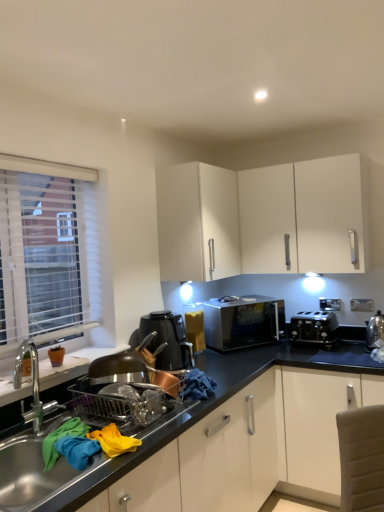
Question: From the image's perspective, is satin silver microwave at center on black plastic toaster at lower right, which is the second appliance in front-to-back order?

Choices:
 (A) yes
 (B) no

Answer: (A)

Question: Is satin silver microwave at center smaller than black plastic toaster at lower right, the first appliance when ordered from back to front?

Choices:
 (A) yes
 (B) no

Answer: (B)

Question: Is the position of satin silver microwave at center more distant than that of black plastic toaster at lower right, which is the second appliance in front-to-back order?

Choices:
 (A) no
 (B) yes

Answer: (B)

Question: Is satin silver microwave at center at the left side of black plastic toaster at lower right, the first appliance when ordered from back to front?

Choices:
 (A) no
 (B) yes

Answer: (B)

Question: Is satin silver microwave at center bigger than black plastic toaster at lower right, the first appliance when ordered from back to front?

Choices:
 (A) yes
 (B) no

Answer: (A)

Question: Choose the correct answer: Is metallic stainless steel sink at lower left inside satin silver microwave at center or outside it?

Choices:
 (A) inside
 (B) outside

Answer: (B)

Question: Is metallic stainless steel sink at lower left in front of or behind satin silver microwave at center in the image?

Choices:
 (A) behind
 (B) front

Answer: (B)

Question: Is point (79, 481) positioned closer to the camera than point (258, 295)?

Choices:
 (A) farther
 (B) closer

Answer: (B)

Question: Is metallic stainless steel sink at lower left bigger or smaller than satin silver microwave at center?

Choices:
 (A) big
 (B) small

Answer: (A)

Question: Considering the positions of black plastic kettle at center and satin silver kettle at right, which is the 2th appliance in left-to-right order, in the image, is black plastic kettle at center wider or thinner than satin silver kettle at right, which is the 2th appliance in left-to-right order,?

Choices:
 (A) wide
 (B) thin

Answer: (A)

Question: Considering the positions of black plastic kettle at center and satin silver kettle at right, which ranks as the second appliance in back-to-front order, in the image, is black plastic kettle at center bigger or smaller than satin silver kettle at right, which ranks as the second appliance in back-to-front order,?

Choices:
 (A) small
 (B) big

Answer: (B)

Question: From a real-world perspective, relative to satin silver kettle at right, the first appliance when ordered from front to back, is black plastic kettle at center vertically above or below?

Choices:
 (A) below
 (B) above

Answer: (B)

Question: Considering the relative positions of black plastic kettle at center and satin silver kettle at right, the first appliance when ordered from front to back, in the image provided, is black plastic kettle at center to the left or to the right of satin silver kettle at right, the first appliance when ordered from front to back,?

Choices:
 (A) left
 (B) right

Answer: (A)

Question: Is metallic stainless steel sink at lower left bigger or smaller than black plastic kettle at center?

Choices:
 (A) small
 (B) big

Answer: (B)

Question: Considering their positions, is metallic stainless steel sink at lower left located in front of or behind black plastic kettle at center?

Choices:
 (A) front
 (B) behind

Answer: (A)